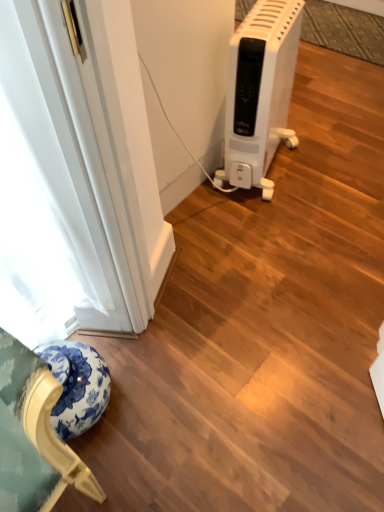
Image resolution: width=384 pixels, height=512 pixels. What are the coordinates of `blue and white ceramic swivel chair at lower left` in the screenshot? It's located at (77, 386).

Image resolution: width=384 pixels, height=512 pixels. What do you see at coordinates (77, 386) in the screenshot? I see `blue and white ceramic swivel chair at lower left` at bounding box center [77, 386].

Measure the distance between point (37,353) and camera.

The distance of point (37,353) from camera is 1.18 meters.

At what (x,y) coordinates should I click in order to perform the action: click on blue and white ceramic swivel chair at lower left. Please return your answer as a coordinate pair (x, y). Looking at the image, I should click on (77, 386).